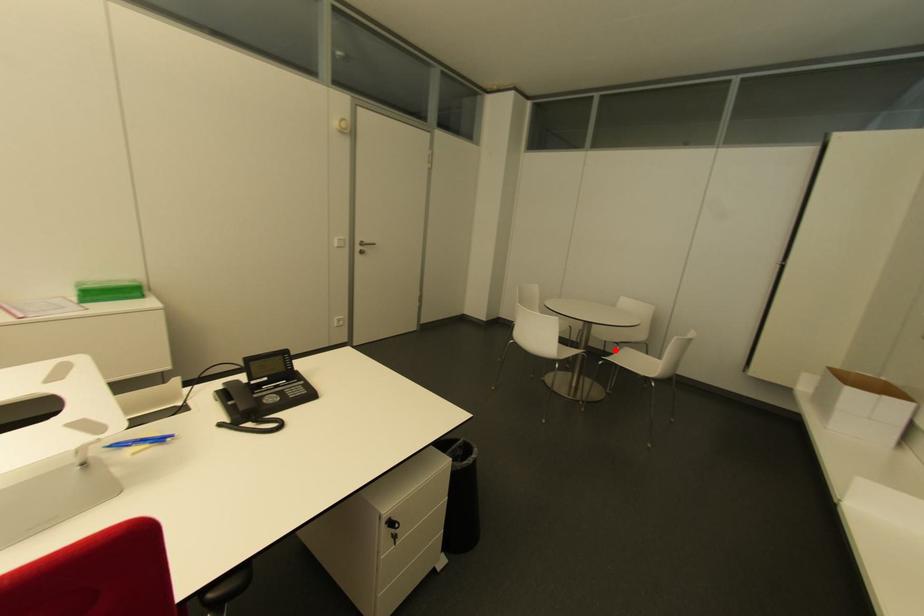
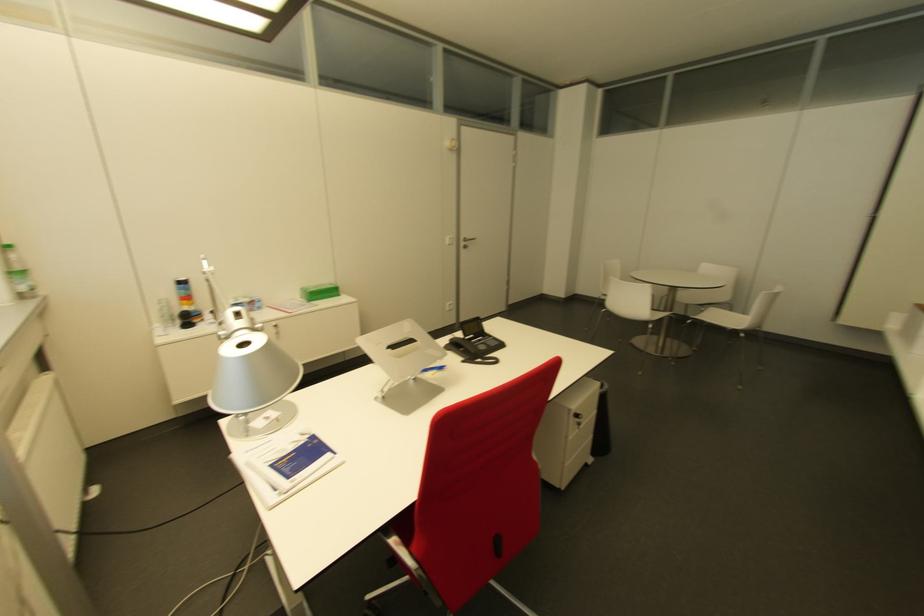
Where in the second image is the point corresponding to the highlighted location from the first image?

(700, 310)